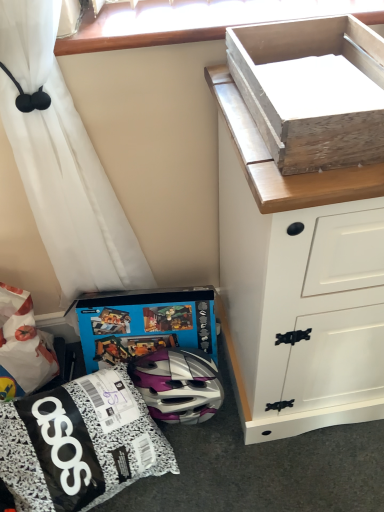
Question: Considering the relative sizes of matte black helmet at lower center and blue cardboard box at lower center in the image provided, is matte black helmet at lower center shorter than blue cardboard box at lower center?

Choices:
 (A) no
 (B) yes

Answer: (A)

Question: Is the position of matte black helmet at lower center more distant than that of blue cardboard box at lower center?

Choices:
 (A) yes
 (B) no

Answer: (B)

Question: From a real-world perspective, is matte black helmet at lower center under blue cardboard box at lower center?

Choices:
 (A) yes
 (B) no

Answer: (B)

Question: Is matte black helmet at lower center taller than blue cardboard box at lower center?

Choices:
 (A) no
 (B) yes

Answer: (B)

Question: Is matte black helmet at lower center turned away from blue cardboard box at lower center?

Choices:
 (A) yes
 (B) no

Answer: (B)

Question: From a real-world perspective, relative to matte black helmet at lower center, is blue cardboard box at lower center vertically above or below?

Choices:
 (A) below
 (B) above

Answer: (A)

Question: Does point (84, 306) appear closer or farther from the camera than point (31, 467)?

Choices:
 (A) farther
 (B) closer

Answer: (A)

Question: Is blue cardboard box at lower center in front of or behind matte black helmet at lower center in the image?

Choices:
 (A) front
 (B) behind

Answer: (B)

Question: Looking at the image, does blue cardboard box at lower center seem bigger or smaller compared to matte black helmet at lower center?

Choices:
 (A) big
 (B) small

Answer: (B)

Question: Is point (241, 398) positioned closer to the camera than point (306, 144)?

Choices:
 (A) farther
 (B) closer

Answer: (A)

Question: Looking at their shapes, would you say white painted wood chest of drawers at upper right is wider or thinner than wooden box at upper right?

Choices:
 (A) thin
 (B) wide

Answer: (B)

Question: Is white painted wood chest of drawers at upper right situated inside wooden box at upper right or outside?

Choices:
 (A) outside
 (B) inside

Answer: (A)

Question: Relative to wooden box at upper right, is white painted wood chest of drawers at upper right in front or behind?

Choices:
 (A) behind
 (B) front

Answer: (A)

Question: From the image's perspective, is white painted wood chest of drawers at upper right located above or below blue cardboard box at lower center?

Choices:
 (A) above
 (B) below

Answer: (A)

Question: In terms of height, does white painted wood chest of drawers at upper right look taller or shorter compared to blue cardboard box at lower center?

Choices:
 (A) tall
 (B) short

Answer: (A)